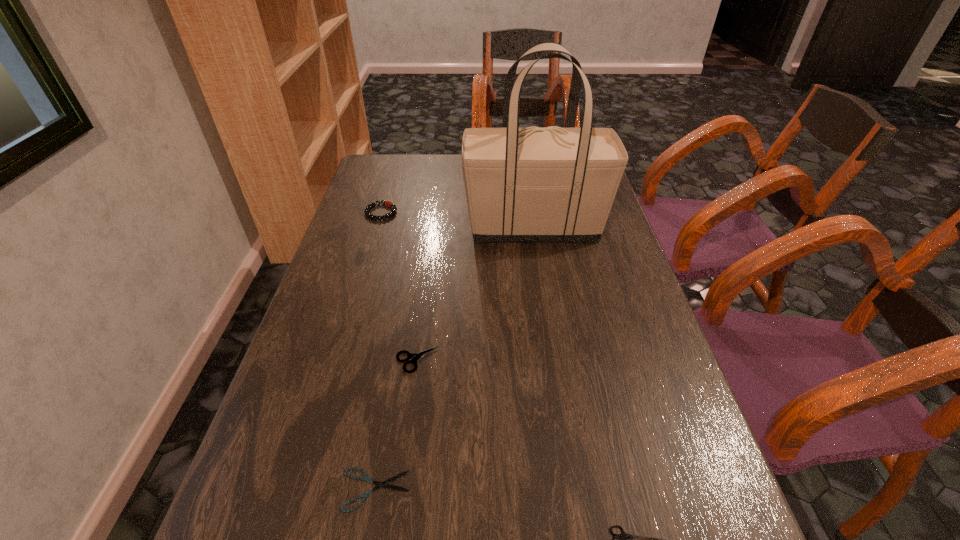
You are a GUI agent. You are given a task and a screenshot of the screen. Output one action in this format:
    pyautogui.click(x=<x>, y=<y>)
    Task: Click on the shopping bag
    The image size is (960, 540).
    Given the screenshot: What is the action you would take?
    pyautogui.click(x=553, y=184)

The height and width of the screenshot is (540, 960). I want to click on bracelet, so click(389, 204).

Where is `the leftmost object`? Image resolution: width=960 pixels, height=540 pixels. the leftmost object is located at coordinates (389, 204).

Identify the location of the third farthest object. (414, 357).

Where is `the third shortest object`? The image size is (960, 540). the third shortest object is located at coordinates (414, 357).

You are a GUI agent. You are given a task and a screenshot of the screen. Output one action in this format:
    pyautogui.click(x=<x>, y=<y>)
    Task: Click on the fourth farthest object
    Image resolution: width=960 pixels, height=540 pixels.
    Given the screenshot: What is the action you would take?
    pyautogui.click(x=366, y=478)

Image resolution: width=960 pixels, height=540 pixels. In order to click on the shortest shears in this screenshot , I will do `click(366, 478)`.

The image size is (960, 540). I want to click on free spot located with handles facing forward on the shopping bag, so pos(367,227).

You are a GUI agent. You are given a task and a screenshot of the screen. Output one action in this format:
    pyautogui.click(x=<x>, y=<y>)
    Task: Click on the free space located with handles facing forward on the shopping bag
    
    Given the screenshot: What is the action you would take?
    pyautogui.click(x=401, y=227)

This screenshot has height=540, width=960. I want to click on vacant space positioned 0.240m with handles facing forward on the shopping bag, so click(380, 227).